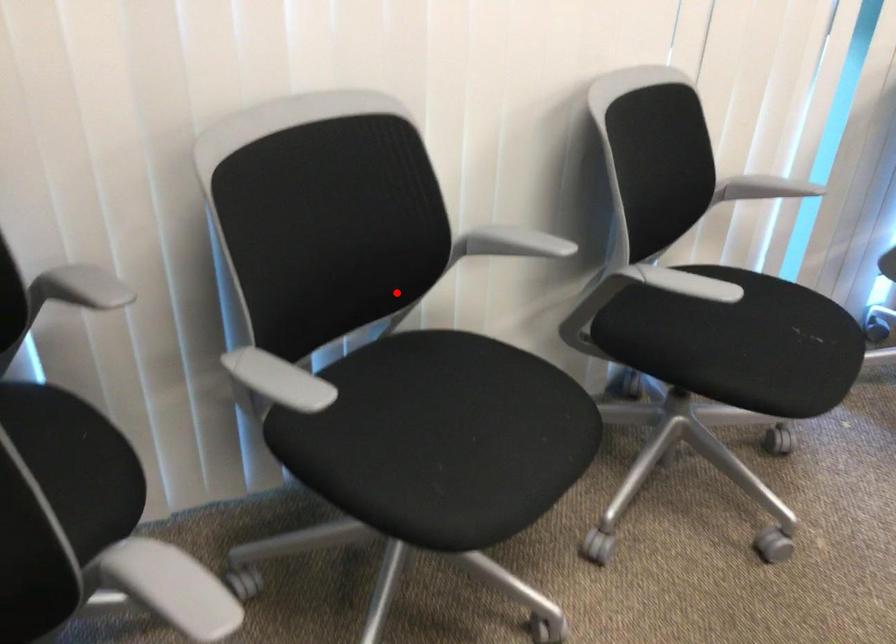
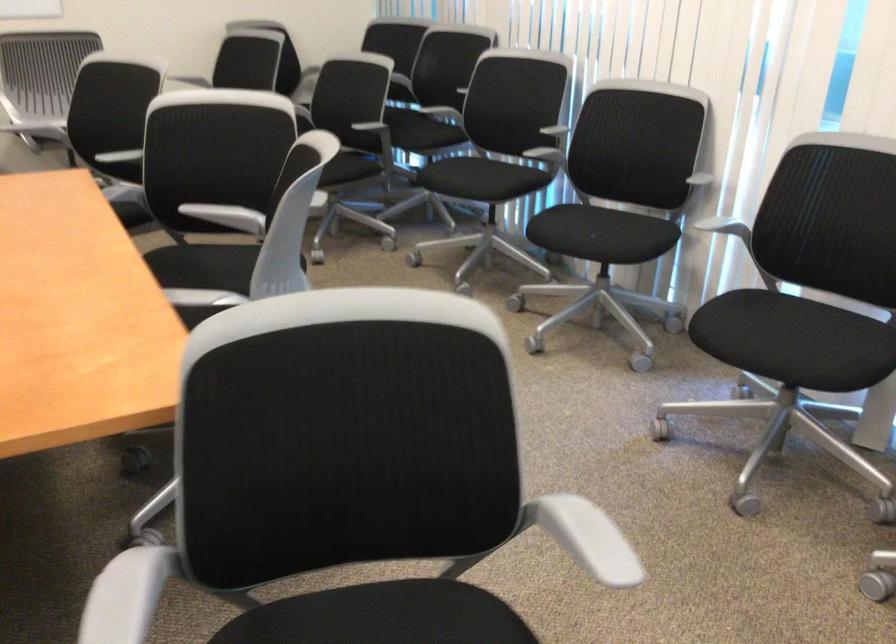
Question: I am providing you with two images of the same scene from different viewpoints. Given a red point in image1, look at the same physical point in image2. Is it:

Choices:
 (A) Closer to the viewpoint
 (B) Farther from the viewpoint

Answer: (B)